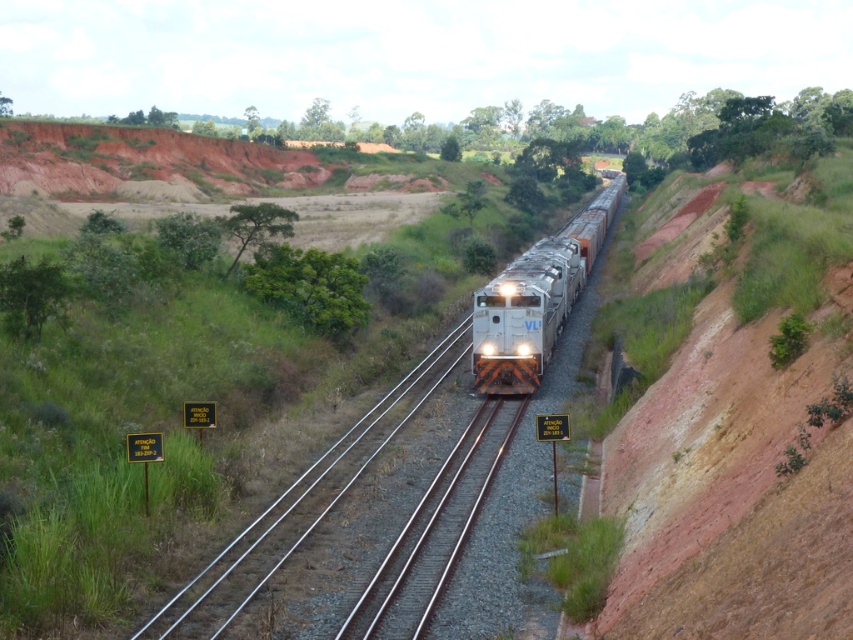
Question: Can you confirm if metal/smooth train track at center is positioned below silver metallic train at center?

Choices:
 (A) no
 (B) yes

Answer: (B)

Question: Is metal/smooth train track at center above silver metallic train at center?

Choices:
 (A) no
 (B) yes

Answer: (A)

Question: Which point is closer to the camera?

Choices:
 (A) silver metallic train at center
 (B) metal/smooth train track at center

Answer: (B)

Question: Which point is closer to the camera taking this photo?

Choices:
 (A) (492, 465)
 (B) (515, 326)

Answer: (A)

Question: Can you confirm if metal/smooth train track at center is wider than silver metallic train at center?

Choices:
 (A) yes
 (B) no

Answer: (B)